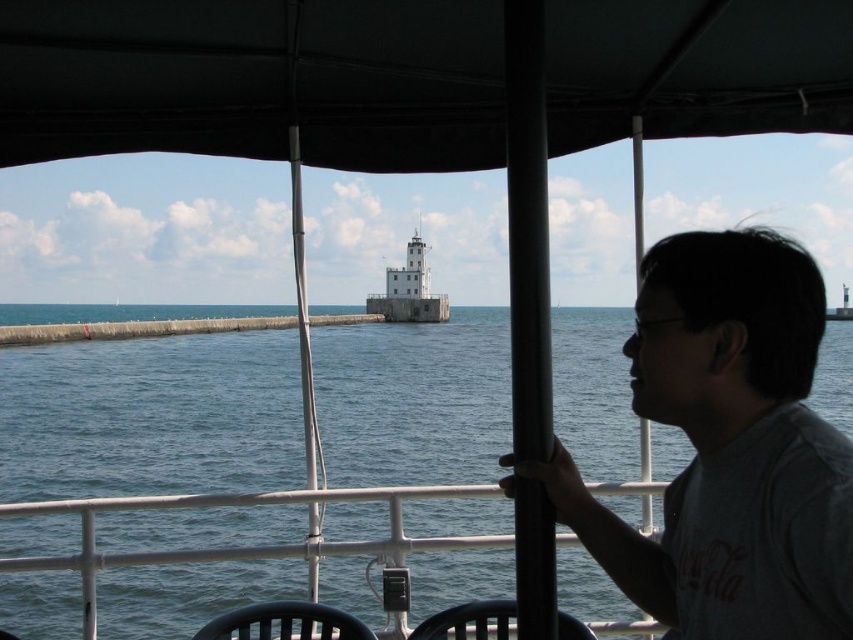
Question: Where is gray matte shirt at right located in relation to blue water at center in the image?

Choices:
 (A) left
 (B) right

Answer: (B)

Question: Does black fabric canopy at upper center appear on the left side of gray matte shirt at right?

Choices:
 (A) no
 (B) yes

Answer: (B)

Question: Which is nearer to the blue water at center?

Choices:
 (A) gray matte shirt at right
 (B) black fabric canopy at upper center

Answer: (B)

Question: Is blue water at center to the left of white metal/rail at lower center from the viewer's perspective?

Choices:
 (A) yes
 (B) no

Answer: (B)

Question: Which point is closer to the camera?

Choices:
 (A) (689, 566)
 (B) (480, 26)

Answer: (A)

Question: Which object is the farthest from the gray matte shirt at right?

Choices:
 (A) blue water at center
 (B) white metal/rail at lower center

Answer: (A)